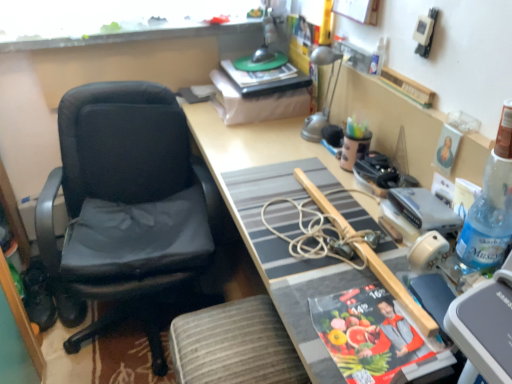
Question: Is silver metallic lamp at upper right far away from wooden desk at center?

Choices:
 (A) no
 (B) yes

Answer: (A)

Question: Is silver metallic lamp at upper right not within wooden desk at center?

Choices:
 (A) no
 (B) yes

Answer: (A)

Question: Is silver metallic lamp at upper right surrounding wooden desk at center?

Choices:
 (A) yes
 (B) no

Answer: (B)

Question: Does silver metallic lamp at upper right have a lesser width compared to wooden desk at center?

Choices:
 (A) no
 (B) yes

Answer: (B)

Question: From a real-world perspective, is silver metallic lamp at upper right under wooden desk at center?

Choices:
 (A) no
 (B) yes

Answer: (A)

Question: Considering the relative positions of wooden picture frame at upper center and transparent plastic spray bottle at upper right, the 1th bottle from the back, in the image provided, is wooden picture frame at upper center to the left or to the right of transparent plastic spray bottle at upper right, the 1th bottle from the back,?

Choices:
 (A) right
 (B) left

Answer: (B)

Question: Is wooden picture frame at upper center spatially inside transparent plastic spray bottle at upper right, acting as the second bottle starting from the bottom, or outside of it?

Choices:
 (A) outside
 (B) inside

Answer: (A)

Question: Considering the positions of wooden picture frame at upper center and transparent plastic spray bottle at upper right, placed as the 1th bottle when sorted from left to right, in the image, is wooden picture frame at upper center wider or thinner than transparent plastic spray bottle at upper right, placed as the 1th bottle when sorted from left to right,?

Choices:
 (A) thin
 (B) wide

Answer: (B)

Question: From a real-world perspective, is wooden picture frame at upper center positioned above or below transparent plastic spray bottle at upper right, placed as the 1th bottle when sorted from left to right?

Choices:
 (A) below
 (B) above

Answer: (B)

Question: Considering the positions of silver metallic lamp at upper right and transparent plastic spray bottle at upper right, the 2th bottle viewed from the right, in the image, is silver metallic lamp at upper right wider or thinner than transparent plastic spray bottle at upper right, the 2th bottle viewed from the right,?

Choices:
 (A) thin
 (B) wide

Answer: (B)

Question: Is silver metallic lamp at upper right inside the boundaries of transparent plastic spray bottle at upper right, acting as the second bottle starting from the bottom, or outside?

Choices:
 (A) inside
 (B) outside

Answer: (B)

Question: Is silver metallic lamp at upper right in front of or behind transparent plastic spray bottle at upper right, which ranks as the 1th bottle in top-to-bottom order, in the image?

Choices:
 (A) front
 (B) behind

Answer: (B)

Question: Is silver metallic lamp at upper right bigger or smaller than transparent plastic spray bottle at upper right, placed as the 1th bottle when sorted from left to right?

Choices:
 (A) big
 (B) small

Answer: (A)

Question: Is point (72, 23) positioned closer to the camera than point (237, 158)?

Choices:
 (A) farther
 (B) closer

Answer: (A)

Question: Choose the correct answer: Is transparent glass window at upper center inside wooden desk at center or outside it?

Choices:
 (A) outside
 (B) inside

Answer: (A)